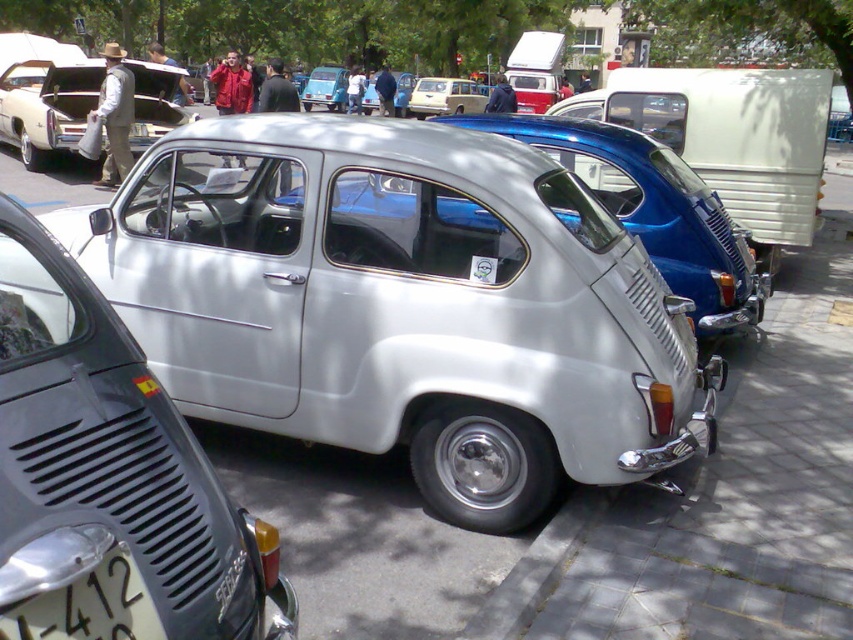
Who is higher up, metallic blue car at center or metallic silver car at center?

Positioned higher is metallic blue car at center.

Who is positioned more to the left, metallic blue car at center or metallic silver car at center?

metallic silver car at center is more to the left.

Between point (598, 115) and point (738, 284), which one is positioned in front?

Point (738, 284)

You are a GUI agent. You are given a task and a screenshot of the screen. Output one action in this format:
    pyautogui.click(x=<x>, y=<y>)
    Task: Click on the metallic blue car at center
    The width and height of the screenshot is (853, 640).
    Given the screenshot: What is the action you would take?
    pyautogui.click(x=732, y=138)

This screenshot has width=853, height=640. Describe the element at coordinates (722, 497) in the screenshot. I see `gray concrete pavement at center` at that location.

Who is more forward, (x=691, y=524) or (x=633, y=234)?

Point (x=691, y=524) is in front.

You are a GUI agent. You are given a task and a screenshot of the screen. Output one action in this format:
    pyautogui.click(x=<x>, y=<y>)
    Task: Click on the gray concrete pavement at center
    The width and height of the screenshot is (853, 640).
    Given the screenshot: What is the action you would take?
    pyautogui.click(x=722, y=497)

Between point (799, 323) and point (94, 609), which one is positioned in front?

Point (94, 609) is in front.

This screenshot has height=640, width=853. Describe the element at coordinates (722, 497) in the screenshot. I see `gray concrete pavement at center` at that location.

Identify the location of gray concrete pavement at center. This screenshot has height=640, width=853. (722, 497).